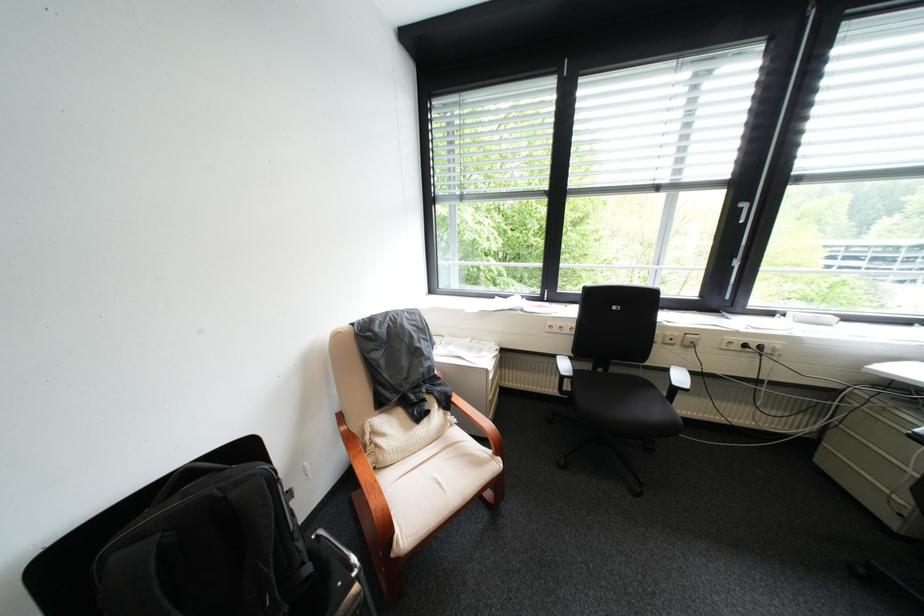
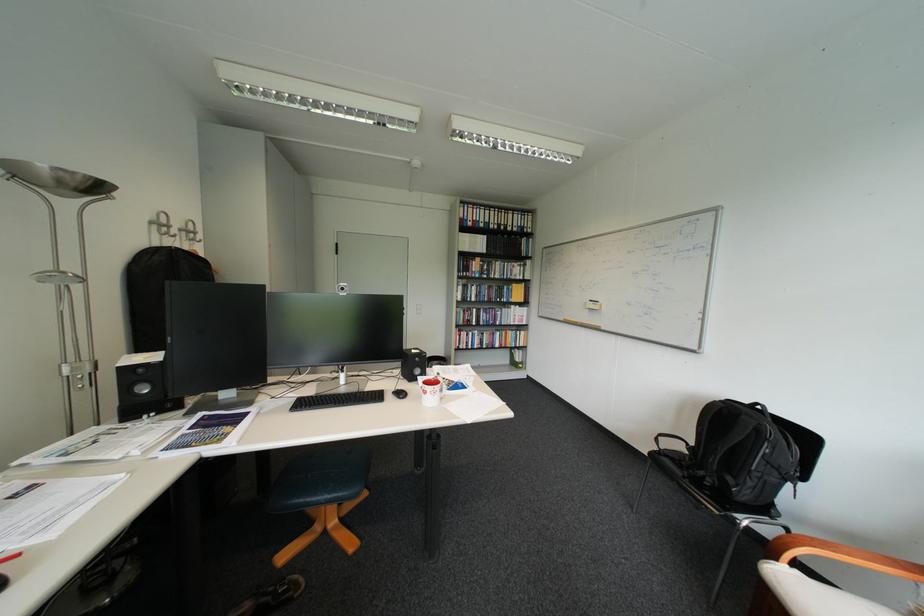
Find the pixel in the second image that matches [418,541] in the first image.

(783, 572)